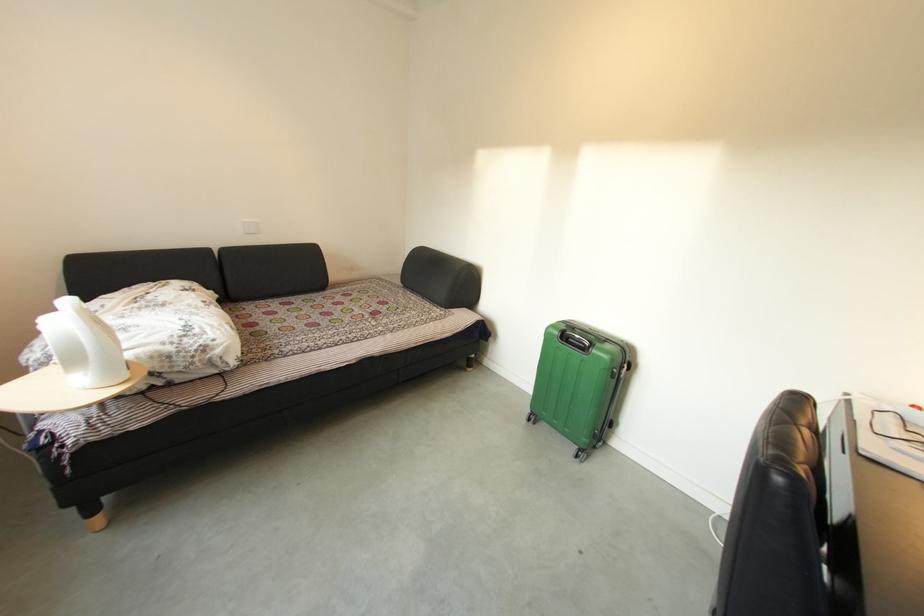
Which object does [250,227] point to?

It corresponds to the white light switch in the image.